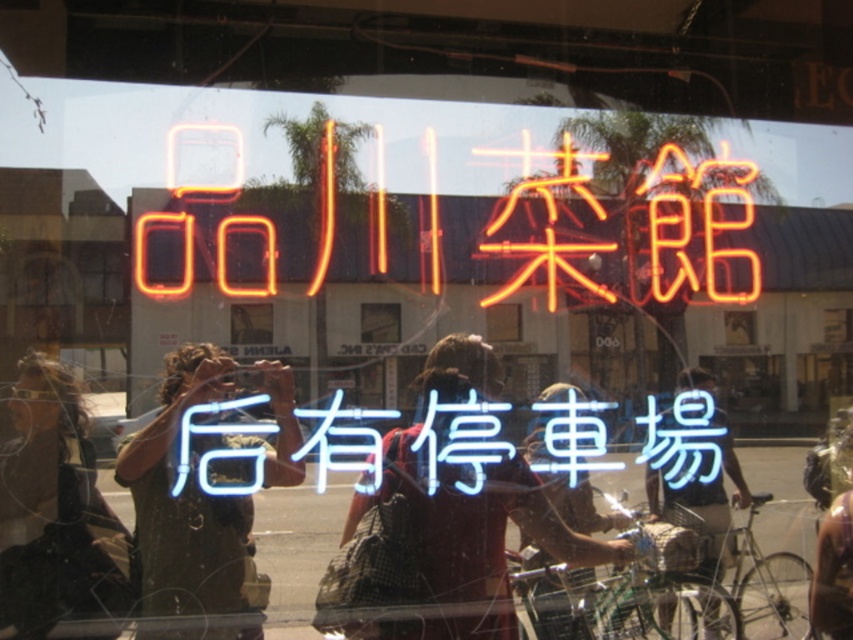
Question: Which object is closer to the camera taking this photo?

Choices:
 (A) neon blue sign at center
 (B) neon orange characters at center
 (C) green matte shirt at left
 (D) dark brown leather jacket at lower left

Answer: (D)

Question: Which object is the farthest from the neon orange sign at upper center?

Choices:
 (A) green matte shirt at left
 (B) white glossy sign at center

Answer: (B)

Question: Is green matte shirt at left above red fabric shirt at center?

Choices:
 (A) yes
 (B) no

Answer: (B)

Question: Is dark brown leather jacket at lower left behind neon orange sign at upper center?

Choices:
 (A) no
 (B) yes

Answer: (A)

Question: Which point is farther from the camera taking this photo?

Choices:
 (A) (500, 403)
 (B) (27, 362)

Answer: (A)

Question: Does dark brown leather jacket at lower left appear under neon orange sign at upper center?

Choices:
 (A) no
 (B) yes

Answer: (B)